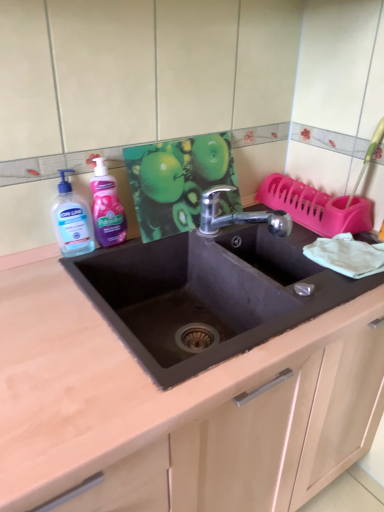
Image resolution: width=384 pixels, height=512 pixels. In order to click on black matte sink at center in this screenshot , I will do pyautogui.click(x=238, y=216).

Measure the distance between pink glossy liquid soap at left, the 2th cleaning product positioned from the left, and camera.

They are 3.40 feet apart.

In order to click on black matte sink at center in this screenshot , I will do `click(103, 383)`.

Where is `black matte sink at center`? The height and width of the screenshot is (512, 384). black matte sink at center is located at coordinates (238, 216).

Can you tell me how much black matte sink at center and transparent liquid soap at left, positioned as the 2th cleaning product in right-to-left order, differ in facing direction?

The angular difference between black matte sink at center and transparent liquid soap at left, positioned as the 2th cleaning product in right-to-left order, is 7.4 degrees.

Considering the relative sizes of black matte sink at center and transparent liquid soap at left, positioned as the 2th cleaning product in right-to-left order, in the image provided, is black matte sink at center smaller than transparent liquid soap at left, positioned as the 2th cleaning product in right-to-left order,?

No, black matte sink at center is not smaller than transparent liquid soap at left, positioned as the 2th cleaning product in right-to-left order.

Is black matte sink at center positioned with its back to transparent liquid soap at left, positioned as the 2th cleaning product in right-to-left order?

No, black matte sink at center's orientation is not away from transparent liquid soap at left, positioned as the 2th cleaning product in right-to-left order.

Is black matte sink at center closer to the viewer compared to transparent liquid soap at left, acting as the first cleaning product starting from the left?

Yes, the depth of black matte sink at center is less than that of transparent liquid soap at left, acting as the first cleaning product starting from the left.

Which object is wider, black matte sink at center or transparent liquid soap at left, acting as the first cleaning product starting from the left?

black matte sink at center is wider.

Is black matte sink at center inside or outside of transparent liquid soap at left, acting as the first cleaning product starting from the left?

black matte sink at center lies outside transparent liquid soap at left, acting as the first cleaning product starting from the left.

Identify the location of sink directly beneath the transparent liquid soap at left, positioned as the 2th cleaning product in right-to-left order (from a real-world perspective). The image size is (384, 512). (238, 216).

What's the angular difference between black matte sink at center and transparent liquid soap at left, acting as the first cleaning product starting from the left,'s facing directions?

They differ by 7.22 degrees in their facing directions.

From the image's perspective, which one is positioned lower, pink glossy liquid soap at left, the 2th cleaning product positioned from the left, or transparent liquid soap at left, acting as the first cleaning product starting from the left?

transparent liquid soap at left, acting as the first cleaning product starting from the left, from the image's perspective.

Is pink glossy liquid soap at left, the 1th cleaning product from the right, positioned with its back to transparent liquid soap at left, positioned as the 2th cleaning product in right-to-left order?

That's not correct — pink glossy liquid soap at left, the 1th cleaning product from the right, is not looking away from transparent liquid soap at left, positioned as the 2th cleaning product in right-to-left order.

Which of these two, pink glossy liquid soap at left, the 1th cleaning product from the right, or transparent liquid soap at left, acting as the first cleaning product starting from the left, stands taller?

pink glossy liquid soap at left, the 1th cleaning product from the right, is taller.

How many degrees apart are the facing directions of transparent liquid soap at left, acting as the first cleaning product starting from the left, and pink glossy liquid soap at left, the 1th cleaning product from the right?

The facing directions of transparent liquid soap at left, acting as the first cleaning product starting from the left, and pink glossy liquid soap at left, the 1th cleaning product from the right, are 2.12 degrees apart.

In the scene shown: From the image's perspective, is transparent liquid soap at left, positioned as the 2th cleaning product in right-to-left order, positioned above or below pink glossy liquid soap at left, the 1th cleaning product from the right?

From the image's perspective, transparent liquid soap at left, positioned as the 2th cleaning product in right-to-left order, appears below pink glossy liquid soap at left, the 1th cleaning product from the right.

Is transparent liquid soap at left, acting as the first cleaning product starting from the left, placed right next to pink glossy liquid soap at left, the 2th cleaning product positioned from the left?

Yes, transparent liquid soap at left, acting as the first cleaning product starting from the left, is in contact with pink glossy liquid soap at left, the 2th cleaning product positioned from the left.

Is transparent liquid soap at left, positioned as the 2th cleaning product in right-to-left order, not within pink glossy liquid soap at left, the 1th cleaning product from the right?

Yes.

Considering the positions of point (69, 222) and point (5, 371), is point (69, 222) closer or farther from the camera than point (5, 371)?

Clearly, point (69, 222) is more distant from the camera than point (5, 371).

Which object is closer to the camera, transparent liquid soap at left, acting as the first cleaning product starting from the left, or black matte sink at center?

black matte sink at center is more forward.

Does transparent liquid soap at left, positioned as the 2th cleaning product in right-to-left order, have a larger size compared to black matte sink at center?

Incorrect, transparent liquid soap at left, positioned as the 2th cleaning product in right-to-left order, is not larger than black matte sink at center.

Is transparent liquid soap at left, acting as the first cleaning product starting from the left, aimed at black matte sink at center?

No, transparent liquid soap at left, acting as the first cleaning product starting from the left, does not turn towards black matte sink at center.

From a real-world perspective, which is physically below, pink glossy liquid soap at left, the 2th cleaning product positioned from the left, or black matte sink at center?

From a 3D spatial view, black matte sink at center is below.

Is pink glossy liquid soap at left, the 1th cleaning product from the right, next to black matte sink at center and touching it?

pink glossy liquid soap at left, the 1th cleaning product from the right, and black matte sink at center are not in contact.

Would you say pink glossy liquid soap at left, the 1th cleaning product from the right, is inside or outside black matte sink at center?

pink glossy liquid soap at left, the 1th cleaning product from the right, is spatially situated outside black matte sink at center.

Between point (95, 167) and point (2, 366), which one is positioned in front?

The point (2, 366) is closer.

This screenshot has height=512, width=384. I want to click on countertop that is in front of the black matte sink at center, so click(x=103, y=383).

Could you tell me if black matte sink at center is facing black matte sink at center?

No, black matte sink at center is not oriented towards black matte sink at center.

Is black matte sink at center not inside black matte sink at center?

black matte sink at center is positioned outside black matte sink at center.

Consider the image. Would you say black matte sink at center is a long distance from black matte sink at center?

No, black matte sink at center is in close proximity to black matte sink at center.

From the black matte sink at center, count the 2nd cleaning product to the left and point to it. Please provide its 2D coordinates.

[(72, 220)]

At what (x,y) coordinates should I click in order to perform the action: click on sink below the transparent liquid soap at left, positioned as the 2th cleaning product in right-to-left order (from a real-world perspective). Please return your answer as a coordinate pair (x, y). The height and width of the screenshot is (512, 384). Looking at the image, I should click on (238, 216).

Looking at the image, which one is located further to pink glossy liquid soap at left, the 2th cleaning product positioned from the left, black matte sink at center or transparent liquid soap at left, positioned as the 2th cleaning product in right-to-left order?

black matte sink at center lies further to pink glossy liquid soap at left, the 2th cleaning product positioned from the left, than the other object.

Looking at the image, which one is located closer to transparent liquid soap at left, acting as the first cleaning product starting from the left, black matte sink at center or pink glossy liquid soap at left, the 2th cleaning product positioned from the left?

pink glossy liquid soap at left, the 2th cleaning product positioned from the left, is closer to transparent liquid soap at left, acting as the first cleaning product starting from the left.

When comparing their distances from pink glossy liquid soap at left, the 1th cleaning product from the right, does transparent liquid soap at left, acting as the first cleaning product starting from the left, or black matte sink at center seem further?

The object further to pink glossy liquid soap at left, the 1th cleaning product from the right, is black matte sink at center.

Based on the photo, based on their spatial positions, is black matte sink at center or black matte sink at center closer to transparent liquid soap at left, positioned as the 2th cleaning product in right-to-left order?

Among the two, black matte sink at center is located nearer to transparent liquid soap at left, positioned as the 2th cleaning product in right-to-left order.

Which object lies further to the anchor point transparent liquid soap at left, acting as the first cleaning product starting from the left, black matte sink at center or pink glossy liquid soap at left, the 2th cleaning product positioned from the left?

Among the two, black matte sink at center is located further to transparent liquid soap at left, acting as the first cleaning product starting from the left.

From the image, which object appears to be farther from pink glossy liquid soap at left, the 2th cleaning product positioned from the left, black matte sink at center or black matte sink at center?

The object further to pink glossy liquid soap at left, the 2th cleaning product positioned from the left, is black matte sink at center.

Consider the image. When comparing their distances from black matte sink at center, does transparent liquid soap at left, positioned as the 2th cleaning product in right-to-left order, or black matte sink at center seem closer?

transparent liquid soap at left, positioned as the 2th cleaning product in right-to-left order, is closer to black matte sink at center.

Which object lies further to the anchor point transparent liquid soap at left, positioned as the 2th cleaning product in right-to-left order, black matte sink at center or black matte sink at center?

black matte sink at center lies further to transparent liquid soap at left, positioned as the 2th cleaning product in right-to-left order, than the other object.

Where is `countertop situated between pink glossy liquid soap at left, the 1th cleaning product from the right, and black matte sink at center from left to right`? The image size is (384, 512). countertop situated between pink glossy liquid soap at left, the 1th cleaning product from the right, and black matte sink at center from left to right is located at coordinates (103, 383).

Find the location of a particular element. Image resolution: width=384 pixels, height=512 pixels. countertop between transparent liquid soap at left, positioned as the 2th cleaning product in right-to-left order, and black matte sink at center is located at coordinates (103, 383).

You are a GUI agent. You are given a task and a screenshot of the screen. Output one action in this format:
    pyautogui.click(x=<x>, y=<y>)
    Task: Click on the cleaning product between transparent liquid soap at left, acting as the first cleaning product starting from the left, and black matte sink at center from left to right
    
    Given the screenshot: What is the action you would take?
    pyautogui.click(x=107, y=207)

You are a GUI agent. You are given a task and a screenshot of the screen. Output one action in this format:
    pyautogui.click(x=<x>, y=<y>)
    Task: Click on the cleaning product between transparent liquid soap at left, acting as the first cleaning product starting from the left, and black matte sink at center from left to right
    This screenshot has height=512, width=384.
    Given the screenshot: What is the action you would take?
    pyautogui.click(x=107, y=207)